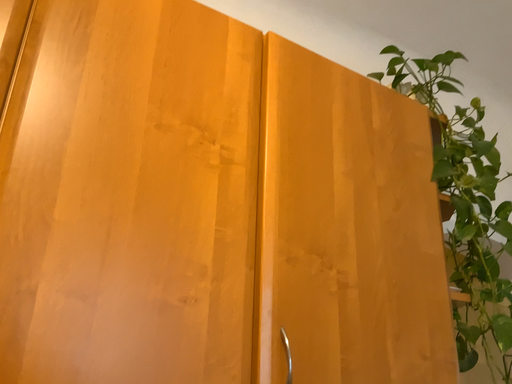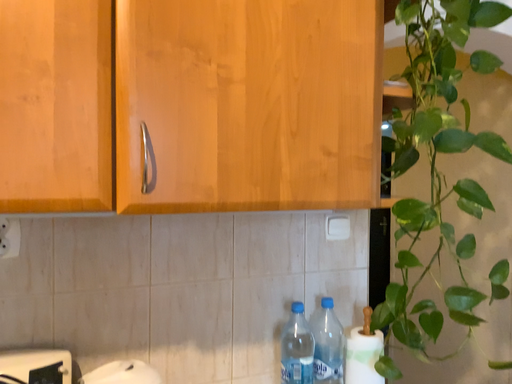
Question: How did the camera likely rotate when shooting the video?

Choices:
 (A) rotated right
 (B) rotated left

Answer: (B)